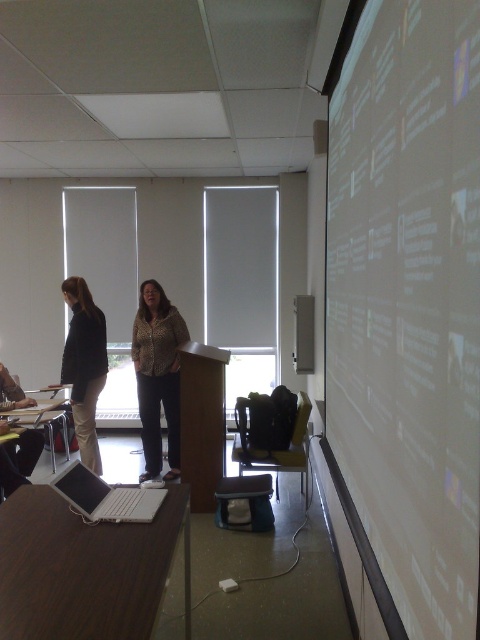
Question: Among these points, which one is farthest from the camera?

Choices:
 (A) (76, 289)
 (B) (166, 419)
 (C) (78, 506)
 (D) (367, 476)

Answer: (B)

Question: Can you confirm if white matte projector screen at right is thinner than white plastic laptop at lower left?

Choices:
 (A) yes
 (B) no

Answer: (A)

Question: Which point is farther from the camera taking this photo?

Choices:
 (A) (370, 68)
 (B) (80, 502)

Answer: (B)

Question: Is matte black jacket at left wider than matte black laptop at lower left?

Choices:
 (A) yes
 (B) no

Answer: (A)

Question: Is white matte projector screen at right wider than matte black jacket at left?

Choices:
 (A) yes
 (B) no

Answer: (B)

Question: Which of the following is the farthest from the observer?

Choices:
 (A) (84, 483)
 (B) (104, 355)
 (C) (169, 396)
 (D) (142, 515)

Answer: (C)